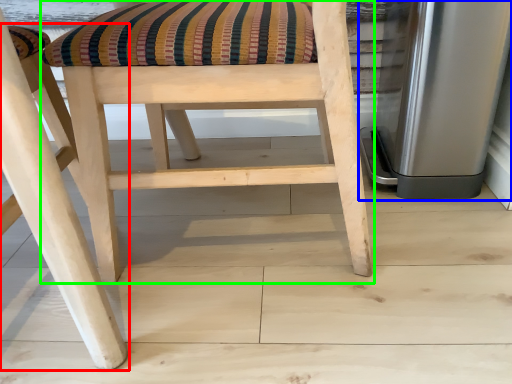
Question: Which object is the closest to the chair (highlighted by a red box)? Choose among these: appliance (highlighted by a blue box) or chair (highlighted by a green box).

Choices:
 (A) appliance
 (B) chair

Answer: (B)